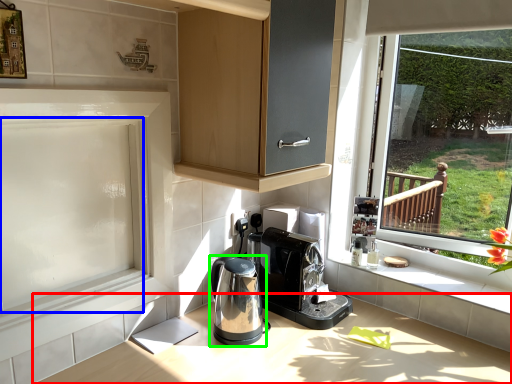
Question: Considering the real-world distances, which object is closest to countertop (highlighted by a red box)? screen door (highlighted by a blue box) or home appliance (highlighted by a green box).

Choices:
 (A) screen door
 (B) home appliance

Answer: (B)